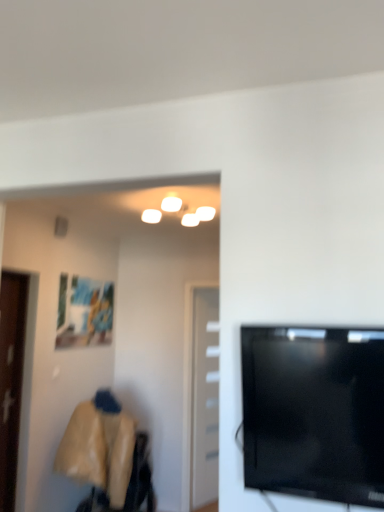
Question: In terms of width, does black glossy tv at right look wider or thinner when compared to white glossy door at center, which is the 2th door in front-to-back order?

Choices:
 (A) thin
 (B) wide

Answer: (B)

Question: In the image, is black glossy tv at right on the left side or the right side of white glossy door at center, which is counted as the first door, starting from the back?

Choices:
 (A) left
 (B) right

Answer: (B)

Question: Estimate the real-world distances between objects in this image. Which object is closer to the black glossy tv at right?

Choices:
 (A) brown wooden door at left, the first door when ordered from front to back
 (B) white glossy door at center, which is the 2th door in front-to-back order
 (C) matte plastic picture frame at upper left

Answer: (A)

Question: Considering the real-world distances, which object is farthest from the white glossy door at center, which is counted as the first door, starting from the back?

Choices:
 (A) black glossy tv at right
 (B) matte plastic picture frame at upper left
 (C) brown wooden door at left, positioned as the 2th door in back-to-front order

Answer: (A)